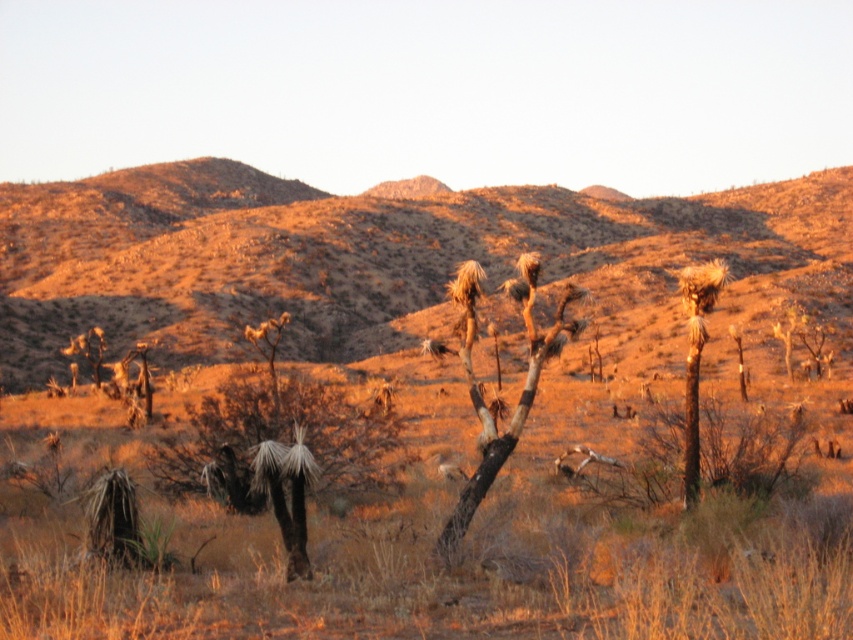
Question: Estimate the real-world distances between objects in this image. Which object is farther from the dried grass at center?

Choices:
 (A) brown rough bark tree at center
 (B) brown woody tree at center

Answer: (B)

Question: Which point is farther from the camera taking this photo?

Choices:
 (A) (277, 500)
 (B) (691, 268)
 (C) (717, 232)

Answer: (C)

Question: Which object appears closest to the camera in this image?

Choices:
 (A) brown woody tree at center
 (B) brown rough bark tree at center
 (C) brown woody at right

Answer: (A)

Question: Does dried grass at center come behind brown woody tree at center?

Choices:
 (A) no
 (B) yes

Answer: (B)

Question: Is brown rough bark tree at center bigger than brown woody at right?

Choices:
 (A) yes
 (B) no

Answer: (B)

Question: In this image, where is brown woody tree at center located relative to brown woody at right?

Choices:
 (A) above
 (B) below

Answer: (B)